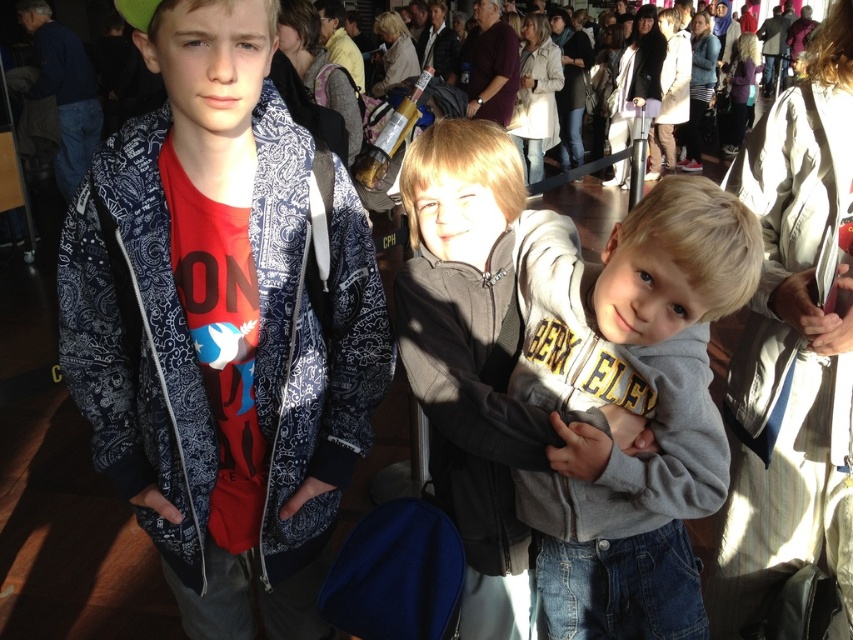
You are a photographer trying to capture a clear photo of the matte blue jacket at center and the gray fleece hoodie at center. Since the background is busy, you want to focus on the height difference between them. Which object should you adjust your camera angle to highlight?

The matte blue jacket at center is taller than the gray fleece hoodie at center, so adjusting the camera angle to emphasize their vertical positions would highlight this difference.

You are a photographer setting up a camera to capture the two boys in the center of the image. The matte blue jacket at center and the gray fleece hoodie at center are standing close to each other. Based on their sizes, which boy should you position closer to the camera to ensure both fit within the frame?

The matte blue jacket at center has a larger width than the gray fleece hoodie at center. To ensure both fit within the frame, position the matte blue jacket at center closer to the camera so its larger size can be accommodated while keeping the gray fleece hoodie at center slightly farther back.